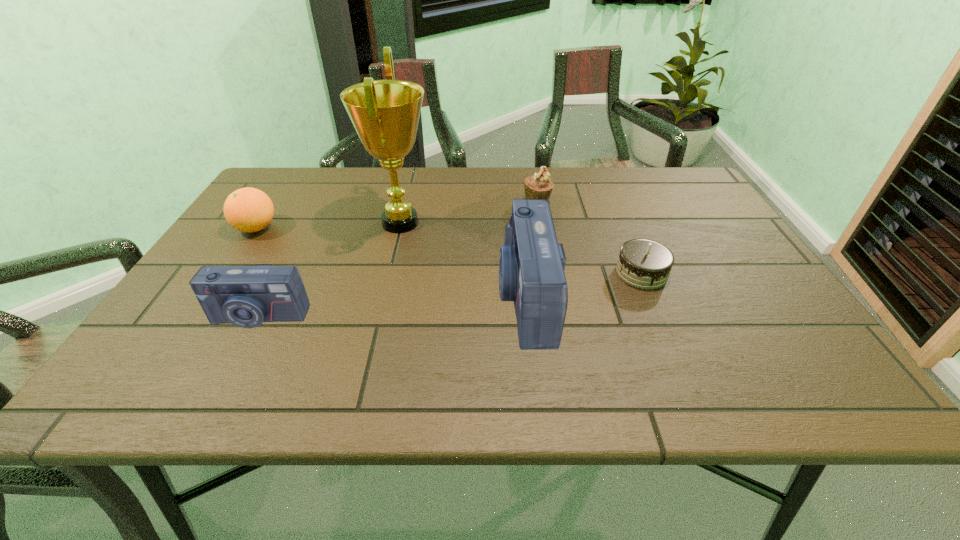
Image resolution: width=960 pixels, height=540 pixels. In order to click on orange positioned at the left edge in this screenshot , I will do `click(248, 209)`.

Where is `object that is positioned at the near left corner`? object that is positioned at the near left corner is located at coordinates (246, 296).

The image size is (960, 540). I want to click on blank space at the far edge of the desktop, so click(x=513, y=187).

This screenshot has height=540, width=960. I want to click on vacant area at the near edge of the desktop, so click(467, 338).

In the image, there is a desktop. Where is `vacant space at the left edge`? This screenshot has width=960, height=540. vacant space at the left edge is located at coordinates (216, 259).

The image size is (960, 540). Identify the location of vacant space at the right edge of the desktop. (708, 252).

Find the location of a particular element. Image resolution: width=960 pixels, height=540 pixels. vacant space at the far left corner of the desktop is located at coordinates (288, 198).

Image resolution: width=960 pixels, height=540 pixels. Identify the location of free spot at the near right corner of the desktop. point(815,348).

Identify the location of empty space between the left camera and the third object from left to right. This screenshot has height=540, width=960. (329, 269).

I want to click on vacant space that's between the orange and the tallest object, so click(328, 225).